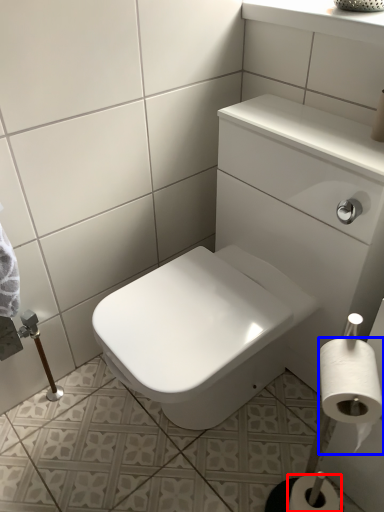
Question: Which of the following is the farthest to the observer, toilet paper (highlighted by a red box) or toilet paper (highlighted by a blue box)?

Choices:
 (A) toilet paper
 (B) toilet paper

Answer: (A)